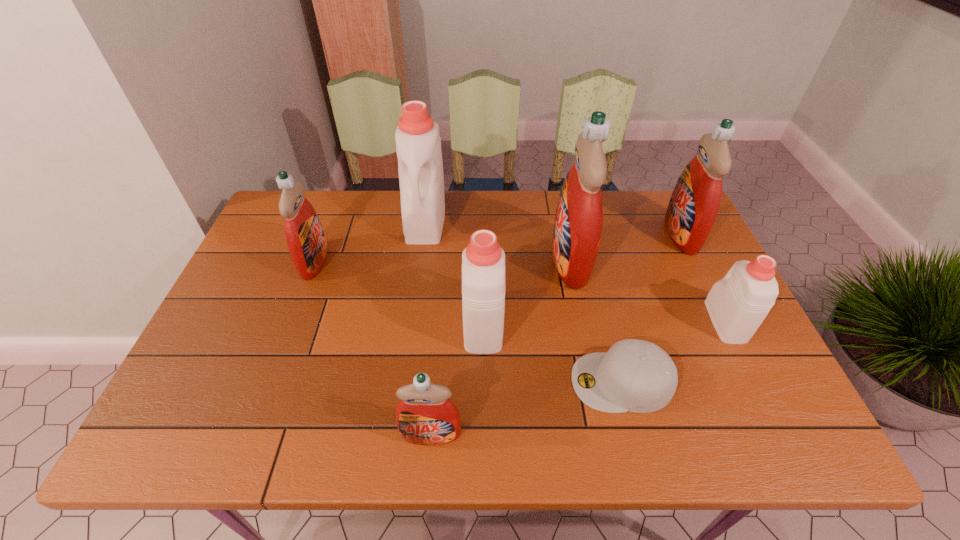
Identify which red detergent is located as the second nearest to the tallest object. Please provide its 2D coordinates. Your answer should be formatted as a tuple, i.e. [(x, y)], where the tuple contains the x and y coordinates of a point satisfying the conditions above.

[(425, 415)]

Locate which red detergent ranks third in proximity to the rightmost white detergent. Please provide its 2D coordinates. Your answer should be formatted as a tuple, i.e. [(x, y)], where the tuple contains the x and y coordinates of a point satisfying the conditions above.

[(425, 415)]

Locate which white detergent ranks in proximity to the nearest object. Please provide its 2D coordinates. Your answer should be formatted as a tuple, i.e. [(x, y)], where the tuple contains the x and y coordinates of a point satisfying the conditions above.

[(483, 261)]

You are a GUI agent. You are given a task and a screenshot of the screen. Output one action in this format:
    pyautogui.click(x=<x>, y=<y>)
    Task: Click on the white detergent that is the closest to the cap
    This screenshot has height=540, width=960.
    Given the screenshot: What is the action you would take?
    pyautogui.click(x=483, y=261)

Where is `free space that satisfies the following two spatial constraints: 1. on the front surface of the second red detergent from right to left; 2. on the front surface of the nearest detergent`? free space that satisfies the following two spatial constraints: 1. on the front surface of the second red detergent from right to left; 2. on the front surface of the nearest detergent is located at coordinates (606, 434).

Locate an element on the screen. The width and height of the screenshot is (960, 540). blank area in the image that satisfies the following two spatial constraints: 1. on the handle side of the rightmost white detergent; 2. on the front surface of the rightmost red detergent is located at coordinates (683, 234).

You are a GUI agent. You are given a task and a screenshot of the screen. Output one action in this format:
    pyautogui.click(x=<x>, y=<y>)
    Task: Click on the free space that satisfies the following two spatial constraints: 1. on the handle side of the second smallest white detergent; 2. on the front surface of the leftmost object
    The image size is (960, 540).
    Given the screenshot: What is the action you would take?
    pyautogui.click(x=483, y=261)